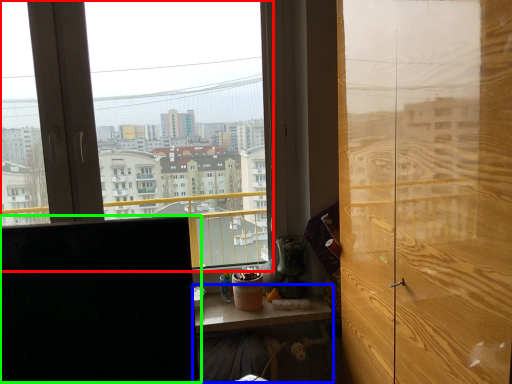
Question: Which is farther away from window (highlighted by a red box)? table (highlighted by a blue box) or computer monitor (highlighted by a green box)?

Choices:
 (A) table
 (B) computer monitor

Answer: (B)